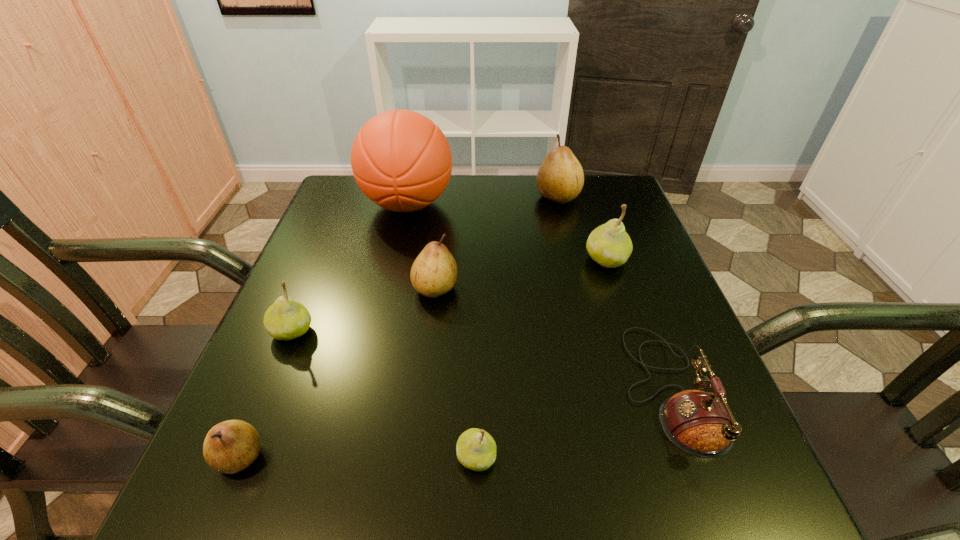
Where is `basketball`? The height and width of the screenshot is (540, 960). basketball is located at coordinates (402, 161).

In order to click on orange basketball in this screenshot , I will do `click(402, 161)`.

I want to click on the rightmost brown pear, so click(x=560, y=178).

At what (x,y) coordinates should I click in order to perform the action: click on the farthest pear. Please return your answer as a coordinate pair (x, y). The height and width of the screenshot is (540, 960). Looking at the image, I should click on (560, 178).

This screenshot has width=960, height=540. Find the location of `the biggest green pear`. the biggest green pear is located at coordinates [609, 245].

I want to click on the farthest green pear, so click(x=609, y=245).

Find the location of a particular element. The height and width of the screenshot is (540, 960). the second brown pear from right to left is located at coordinates (434, 272).

You are a GUI agent. You are given a task and a screenshot of the screen. Output one action in this format:
    pyautogui.click(x=<x>, y=<y>)
    Task: Click on the second nearest brown pear
    
    Given the screenshot: What is the action you would take?
    pyautogui.click(x=434, y=272)

This screenshot has height=540, width=960. I want to click on the second smallest green pear, so click(x=286, y=319).

The image size is (960, 540). Find the location of `the third nearest pear`. the third nearest pear is located at coordinates (286, 319).